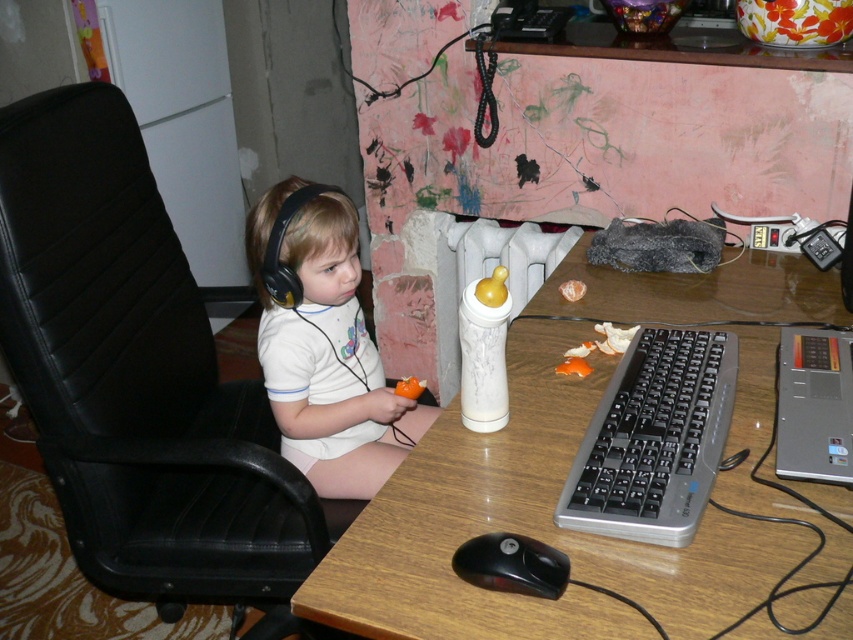
You need to place both the white plastic bottle at center and the black plastic mouse at lower center on a shelf that can only hold items with a combined width of 20 cm. If the mouse is 5 cm wide, will they fit together?

The white plastic bottle at center is wider than the black plastic mouse at lower center. Since the mouse is 5 cm wide, the bottle must be wider than 5 cm. Adding their widths would exceed 20 cm, so they won

You are a parent trying to organize your child study area. You see the black leather chair at left and the black matte earphone at left. Which one is closer to the floor?

The black leather chair at left is below black matte earphone at left, so the black leather chair at left is closer to the floor.

You are a delivery robot trying to place a small package on the desk. The package is the size of the black plastic mouse at lower center. Can you fit the package on the desk without overlapping the matte white shirt at center?

The matte white shirt at center is bigger than the black plastic mouse at lower center. Since the package is the size of the black plastic mouse at lower center, it can fit on the desk without overlapping the matte white shirt at center as long as there is enough space elsewhere.